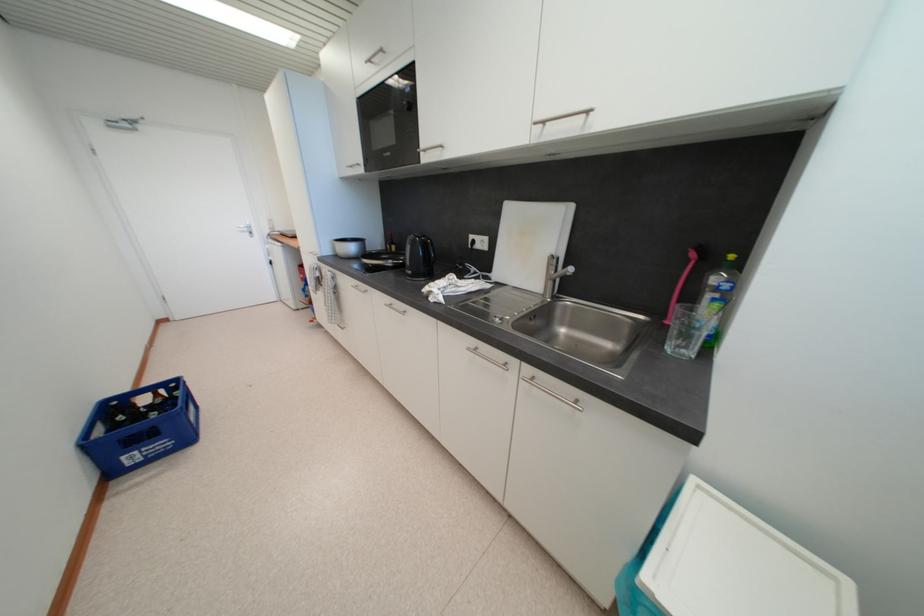
The location [684,275] corresponds to which object?

It corresponds to the pink dish brush in the image.